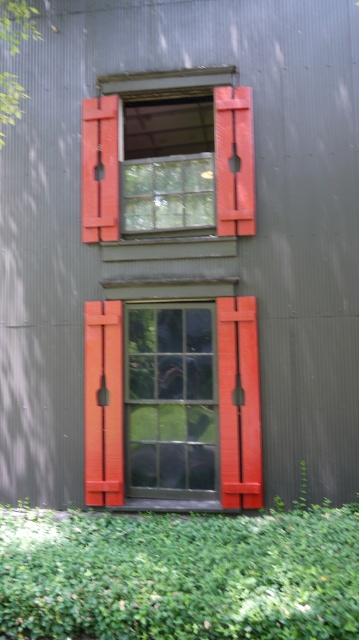
Does green leafy hedge at lower center have a smaller size compared to matte glass window at center?

No, green leafy hedge at lower center is not smaller than matte glass window at center.

This screenshot has height=640, width=359. I want to click on green leafy hedge at lower center, so click(179, 576).

Where is `green leafy hedge at lower center`? The image size is (359, 640). green leafy hedge at lower center is located at coordinates (179, 576).

You are a GUI agent. You are given a task and a screenshot of the screen. Output one action in this format:
    pyautogui.click(x=<x>, y=<y>)
    Task: Click on the green leafy hedge at lower center
    The height and width of the screenshot is (640, 359).
    Given the screenshot: What is the action you would take?
    179,576